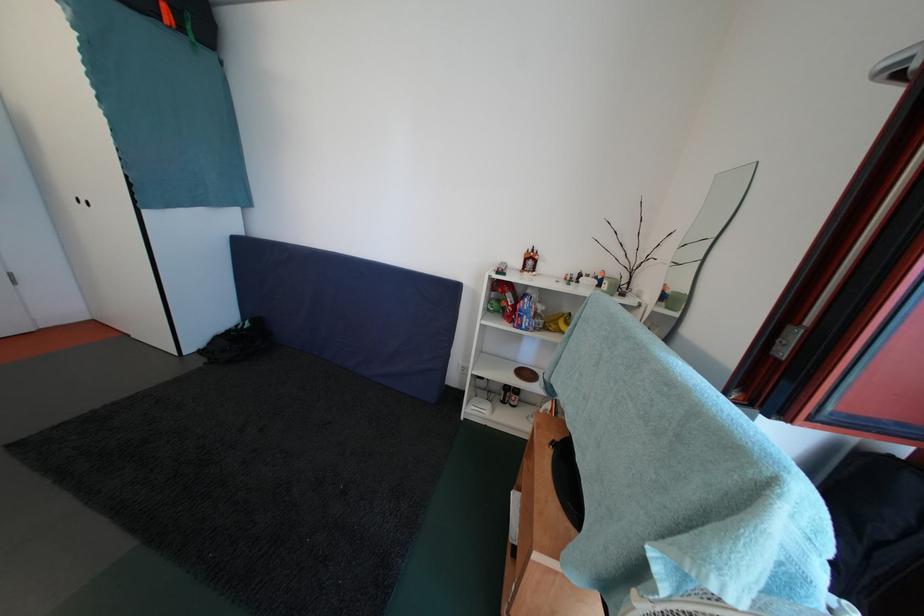
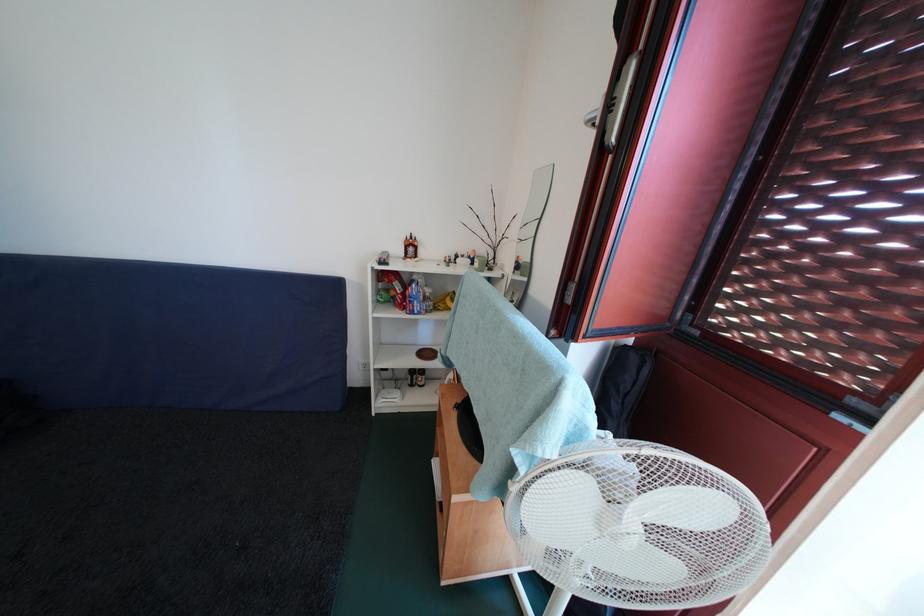
Find the pixel in the second image that matches [551,314] in the first image.

(438, 296)